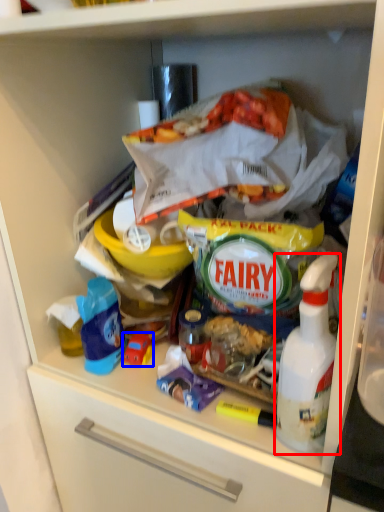
Question: Which object is further to the camera taking this photo, bottle (highlighted by a red box) or toy (highlighted by a blue box)?

Choices:
 (A) bottle
 (B) toy

Answer: (B)